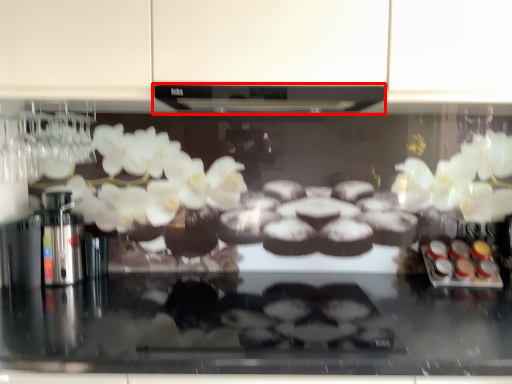
Question: In this image, where is exhaust hood (annotated by the red box) located relative to food?

Choices:
 (A) right
 (B) left

Answer: (B)